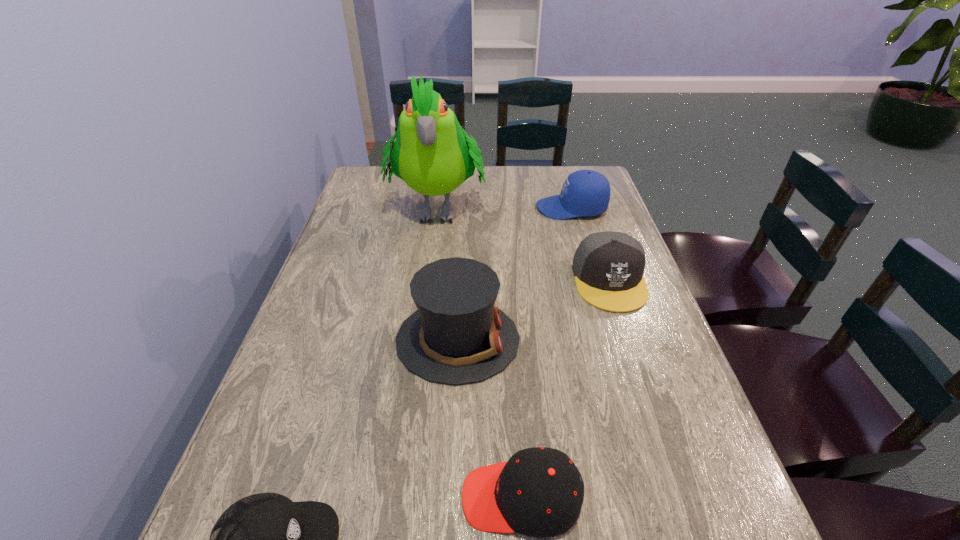
Where is `parakeet at the far edge`? The height and width of the screenshot is (540, 960). parakeet at the far edge is located at coordinates (431, 154).

Where is `cap positioned at the far edge`? The width and height of the screenshot is (960, 540). cap positioned at the far edge is located at coordinates (586, 193).

The image size is (960, 540). What are the coordinates of `object at the left edge` in the screenshot? It's located at (431, 154).

Locate an element on the screen. This screenshot has height=540, width=960. object at the far left corner is located at coordinates (431, 154).

Where is `object present at the far right corner`? object present at the far right corner is located at coordinates (586, 193).

Locate an element on the screen. blank space at the far edge of the desktop is located at coordinates (486, 174).

I want to click on vacant space at the left edge of the desktop, so click(x=297, y=323).

In order to click on vacant region at the right edge of the desktop in this screenshot , I will do pyautogui.click(x=664, y=420).

The height and width of the screenshot is (540, 960). I want to click on unoccupied position between the farthest cap and the fifth shortest object, so click(515, 274).

You are a GUI agent. You are given a task and a screenshot of the screen. Output one action in this format:
    pyautogui.click(x=<x>, y=<y>)
    Task: Click on the empty space between the third nearest cap and the second tallest object
    The height and width of the screenshot is (540, 960).
    Given the screenshot: What is the action you would take?
    pyautogui.click(x=534, y=310)